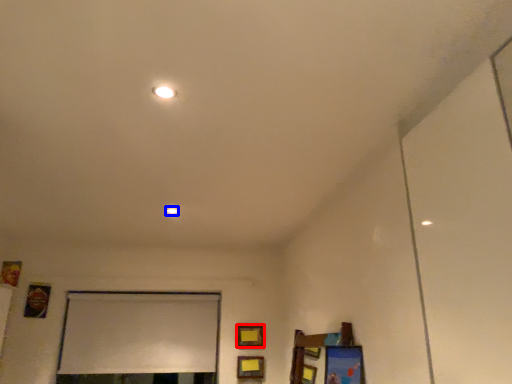
Question: Which of the following is the closest to the observer, picture frame (highlighted by a red box) or light (highlighted by a blue box)?

Choices:
 (A) picture frame
 (B) light

Answer: (B)